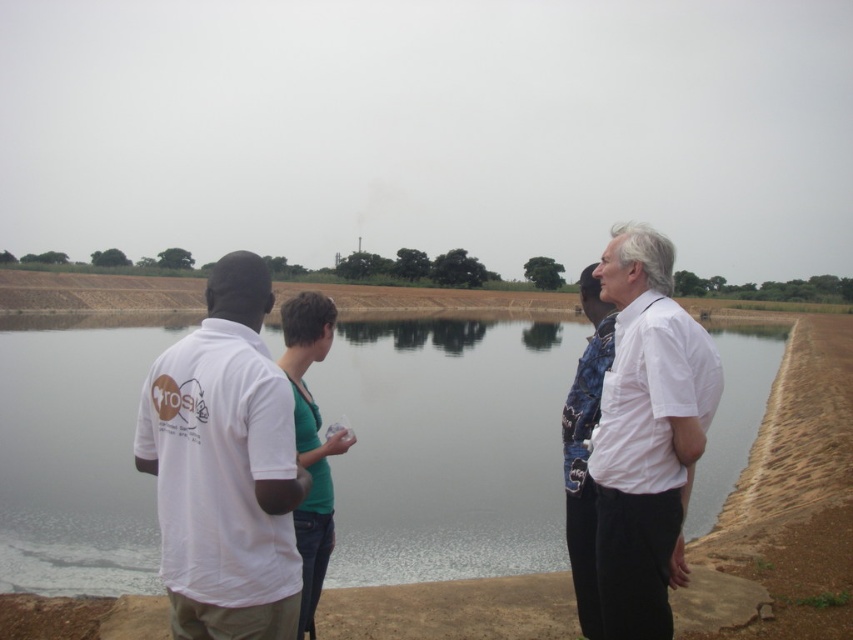
You are standing in the scene and want to walk from the clear water at center to the white cotton shirt at right. Which direction should you move?

You should move to the right because the clear water at center is to the left of the white cotton shirt at right.

You are standing at the dam and want to place a small flag at point A and another at point B. If point A is at coordinates point(421, 516) and point B is at point(177, 552), which point is closer to you?

Point A at point(421, 516) is closer to you than point B at point(177, 552) because it is further to the viewer according to the description.

You are standing at the edge of the dam and want to walk towards the clear water at center. However, there is a white cotton shirt at left in your path. Based on the scene description, can you step around the shirt to reach the water without stepping on it?

The clear water at center is positioned over the white cotton shirt at left, meaning the water is above the shirt. Since the shirt is on the ground, you can step around it to reach the water without stepping on it.